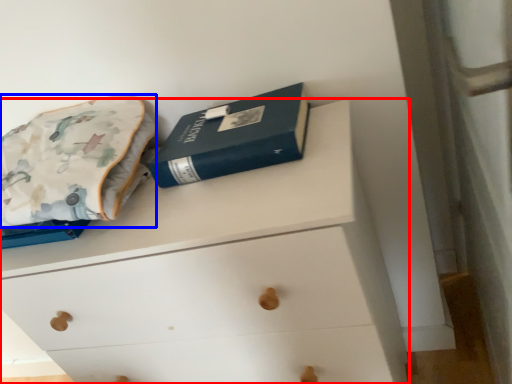
Question: Which point is closer to the camera, chest of drawers (highlighted by a red box) or throw pillow (highlighted by a blue box)?

Choices:
 (A) chest of drawers
 (B) throw pillow

Answer: (A)